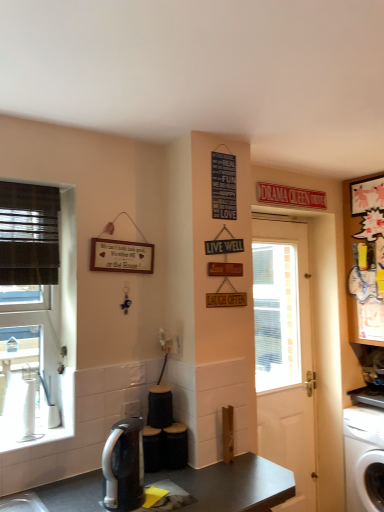
Question: Considering the relative sizes of white plastic washing machine at lower right and cartoon paper cutout at upper right in the image provided, is white plastic washing machine at lower right bigger than cartoon paper cutout at upper right?

Choices:
 (A) yes
 (B) no

Answer: (B)

Question: From a real-world perspective, is white plastic washing machine at lower right on top of cartoon paper cutout at upper right?

Choices:
 (A) no
 (B) yes

Answer: (A)

Question: Is white plastic washing machine at lower right oriented towards cartoon paper cutout at upper right?

Choices:
 (A) no
 (B) yes

Answer: (A)

Question: From the image's perspective, would you say white plastic washing machine at lower right is positioned over cartoon paper cutout at upper right?

Choices:
 (A) no
 (B) yes

Answer: (A)

Question: Does white plastic washing machine at lower right have a lesser height compared to cartoon paper cutout at upper right?

Choices:
 (A) no
 (B) yes

Answer: (B)

Question: Can you see white plastic washing machine at lower right touching cartoon paper cutout at upper right?

Choices:
 (A) no
 (B) yes

Answer: (A)

Question: Is sleek silver coffee maker at lower center thinner than dark gray laminate desk at center?

Choices:
 (A) no
 (B) yes

Answer: (B)

Question: Can you confirm if sleek silver coffee maker at lower center is positioned to the right of dark gray laminate desk at center?

Choices:
 (A) yes
 (B) no

Answer: (B)

Question: Is sleek silver coffee maker at lower center not close to dark gray laminate desk at center?

Choices:
 (A) no
 (B) yes

Answer: (A)

Question: Is the surface of sleek silver coffee maker at lower center in direct contact with dark gray laminate desk at center?

Choices:
 (A) no
 (B) yes

Answer: (A)

Question: Is sleek silver coffee maker at lower center to the left of dark gray laminate desk at center from the viewer's perspective?

Choices:
 (A) yes
 (B) no

Answer: (A)

Question: Considering the relative sizes of sleek silver coffee maker at lower center and dark gray laminate desk at center in the image provided, is sleek silver coffee maker at lower center wider than dark gray laminate desk at center?

Choices:
 (A) yes
 (B) no

Answer: (B)

Question: Would you say dark gray laminate desk at center is a long distance from sleek silver coffee maker at lower center?

Choices:
 (A) no
 (B) yes

Answer: (A)